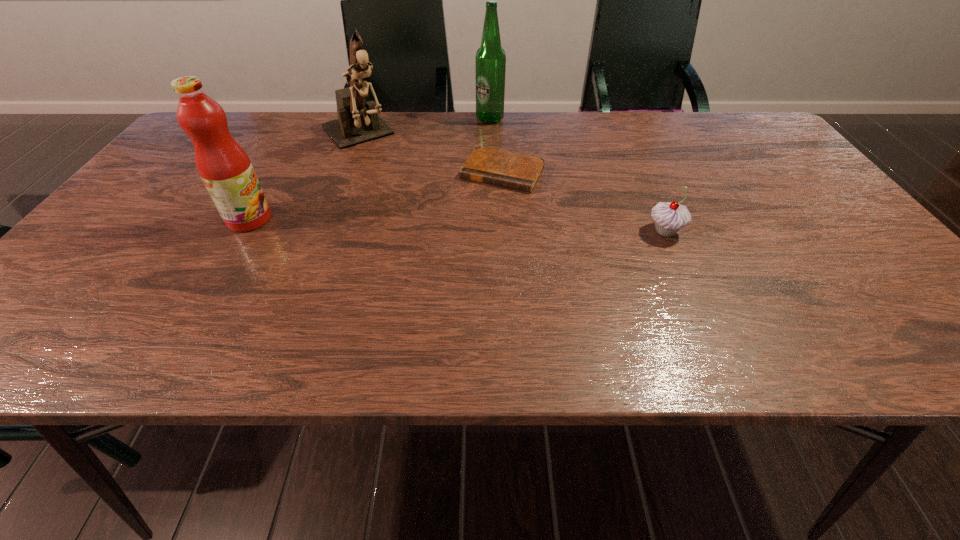
At what (x,y) coordinates should I click in order to perform the action: click on vacant space on the desktop that is between the fruit juice and the second shortest object and is positioned on the spine side of the diary. Please return your answer as a coordinate pair (x, y). This screenshot has height=540, width=960. Looking at the image, I should click on (472, 226).

Identify the location of free spot on the desktop that is between the leftmost object and the fourth tallest object and is positioned on the front-facing side of the figurine. The width and height of the screenshot is (960, 540). (x=437, y=225).

In order to click on vacant space on the desktop that is between the fruit juice and the cupcake and is positioned on the label of the beer bottle in this screenshot , I will do `click(489, 226)`.